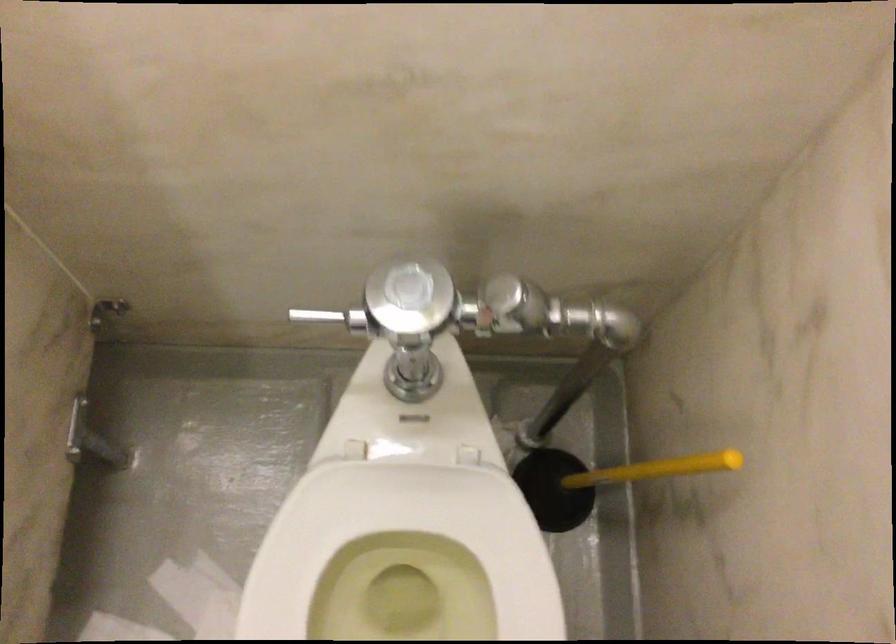
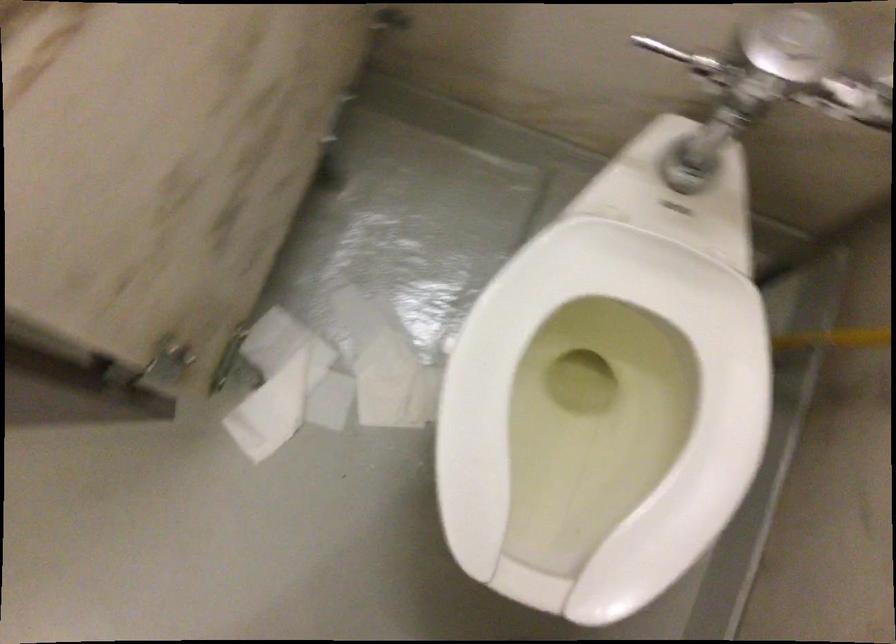
Question: Based on the continuous images, in which direction is the camera rotating? Reply with the corresponding letter.

Choices:
 (A) Left
 (B) Right
 (C) Up
 (D) Down

Answer: (D)